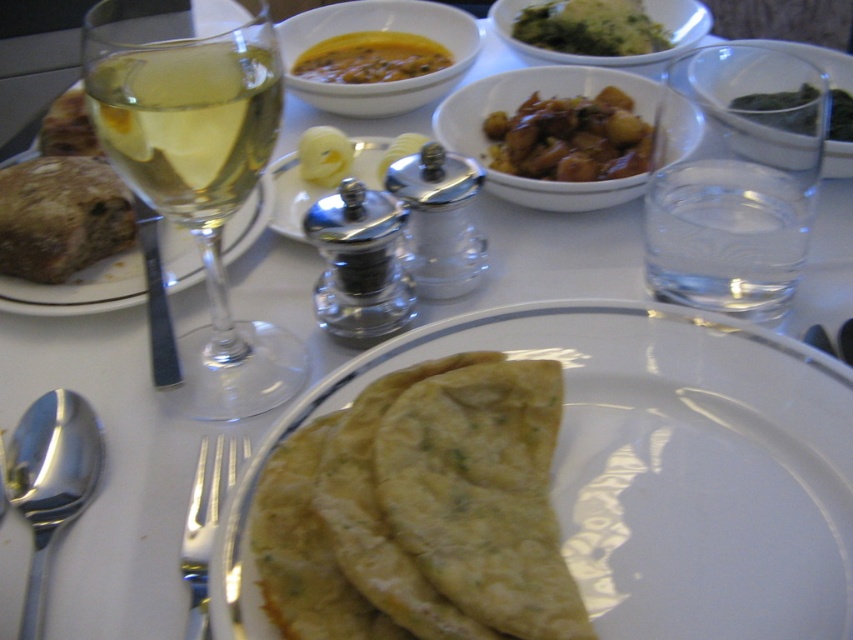
You are a waiter at a restaurant and need to place a new dish on the table. The table has a coordinate system where the bottom left corner is the origin point. The coordinates of the golden brown dough at center are given. Where should you place the new dish so it doesn not overlap with the dough?

The golden brown dough at center is located at coordinates point (421,509). To avoid overlapping, place the new dish away from this point, ensuring there is space between them.

You are a server at a restaurant and need to place a new drink order on the table. The table has a yellow creamy soup at center and a yellow rubber duck at center. Where should you place the drink so it doesn not block the soup or the duck?

The yellow rubber duck at center is behind the yellow creamy soup at center, so placing the drink to the side of the soup would avoid blocking both items.